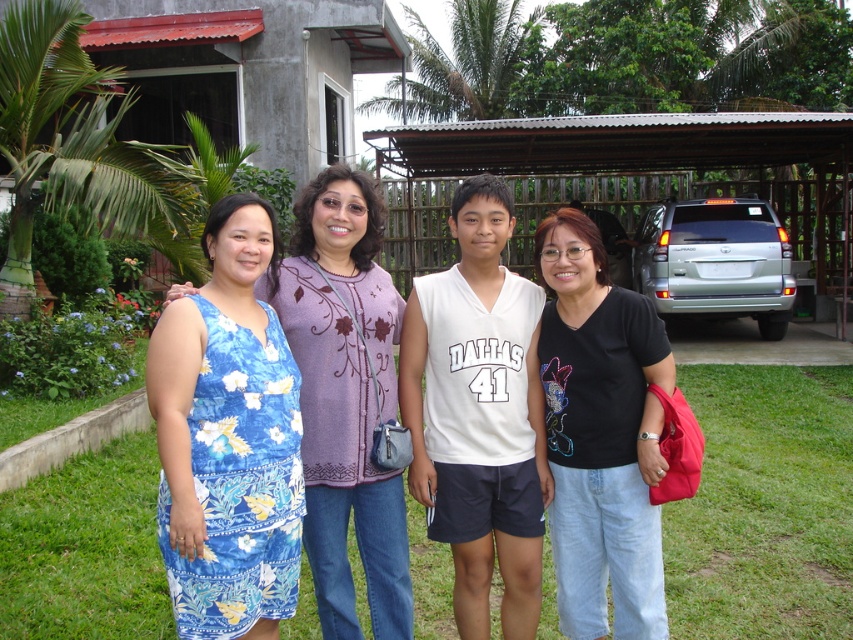
Is blue floral dress at left further to the viewer compared to black cotton shirt at center?

No, blue floral dress at left is in front of black cotton shirt at center.

Is blue floral dress at left to the right of black cotton shirt at center from the viewer's perspective?

No, blue floral dress at left is not to the right of black cotton shirt at center.

Is point (314, 536) positioned in front of point (592, 560)?

Yes, it is in front of point (592, 560).

Locate an element on the screen. The image size is (853, 640). blue floral dress at left is located at coordinates (345, 397).

Can you confirm if white jersey at center is smaller than blue floral dress at left?

Incorrect, white jersey at center is not smaller in size than blue floral dress at left.

Who is higher up, white jersey at center or blue floral dress at left?

blue floral dress at left is above.

Is point (527, 461) farther from viewer compared to point (372, 236)?

No.

Find the location of a particular element. white jersey at center is located at coordinates (479, 413).

Is white jersey at center thinner than black cotton shirt at center?

In fact, white jersey at center might be wider than black cotton shirt at center.

Between white jersey at center and black cotton shirt at center, which one has less height?

With less height is black cotton shirt at center.

Find the location of a particular element. white jersey at center is located at coordinates (479, 413).

Where is `white jersey at center`? white jersey at center is located at coordinates (479, 413).